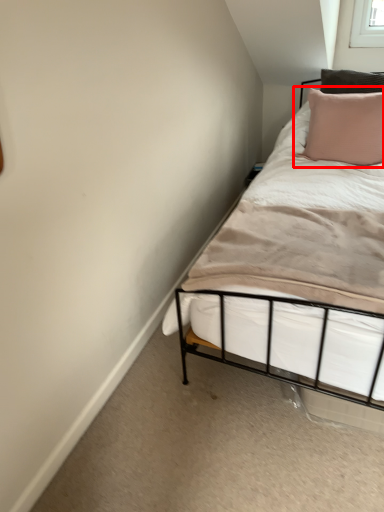
Question: From the image's perspective, where is pillow (annotated by the red box) located relative to mattress?

Choices:
 (A) above
 (B) below

Answer: (A)